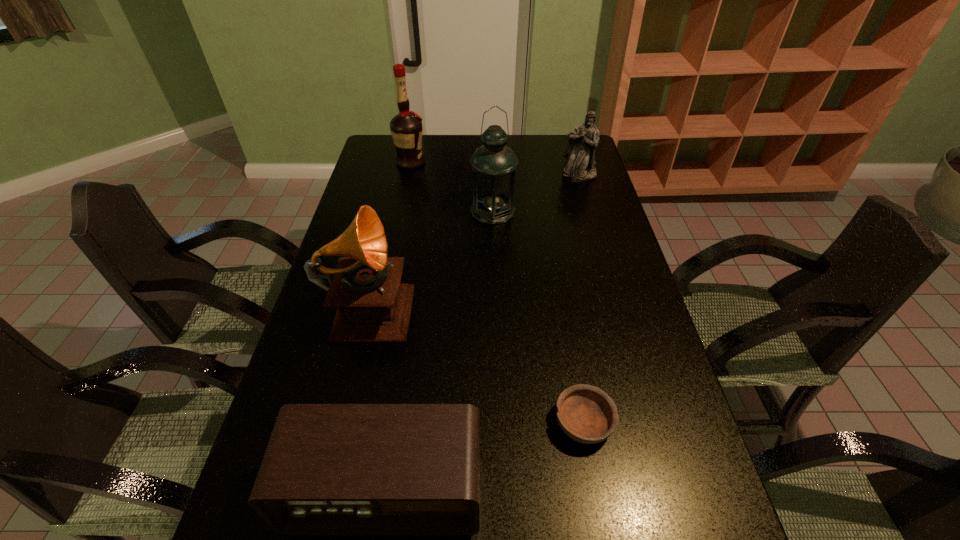
Locate an element on the screen. This screenshot has height=540, width=960. liquor is located at coordinates point(406,128).

Where is `oil lamp`? oil lamp is located at coordinates (493, 164).

The width and height of the screenshot is (960, 540). What are the coordinates of `phonograph record` in the screenshot? It's located at (373, 307).

Identify the location of the rightmost object. The width and height of the screenshot is (960, 540). (580, 165).

Where is `the fourth tallest object`? the fourth tallest object is located at coordinates (580, 165).

You are a GUI agent. You are given a task and a screenshot of the screen. Output one action in this format:
    pyautogui.click(x=<x>, y=<y>)
    Task: Click on the radio receiver
    This screenshot has width=960, height=540.
    Given the screenshot: What is the action you would take?
    pyautogui.click(x=329, y=469)

At what (x,y) coordinates should I click in order to perform the action: click on the fifth tallest object. Please return your answer as a coordinate pair (x, y). This screenshot has width=960, height=540. Looking at the image, I should click on (329, 469).

Locate an element on the screen. the shortest object is located at coordinates (585, 413).

What are the coordinates of `the fifth object from left to right` in the screenshot? It's located at (585, 413).

Identify the location of free space located 0.400m on the front and back of the liquor. The image size is (960, 540). (527, 163).